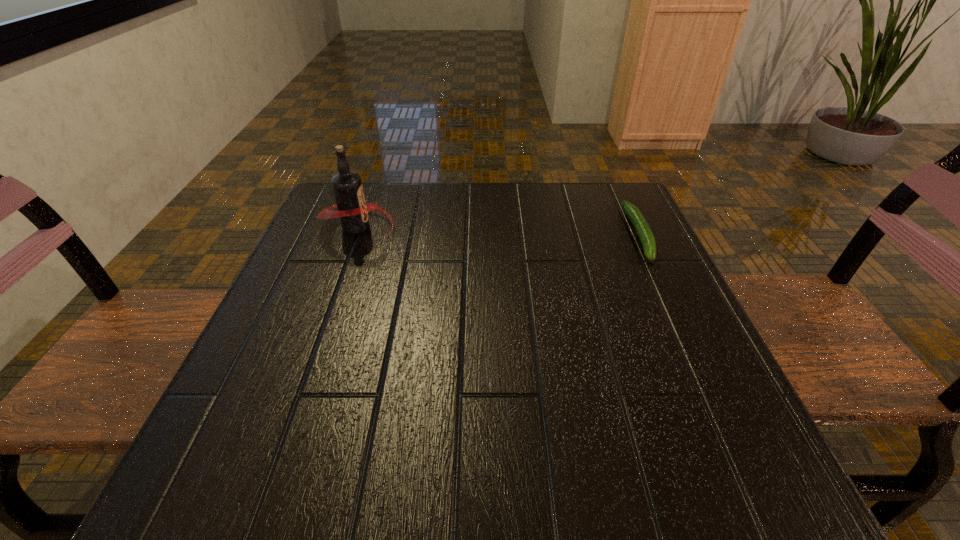
Locate an element on the screen. the left object is located at coordinates (353, 211).

What are the coordinates of `the taller object` in the screenshot? It's located at (353, 211).

Image resolution: width=960 pixels, height=540 pixels. What are the coordinates of `the shorter object` in the screenshot? It's located at (647, 239).

The height and width of the screenshot is (540, 960). Find the location of `the right object`. the right object is located at coordinates (647, 239).

You are a GUI agent. You are given a task and a screenshot of the screen. Output one action in this format:
    pyautogui.click(x=<x>, y=<y>)
    Task: Click on the vacant space located 0.100m on the label of the root beer
    The height and width of the screenshot is (540, 960).
    Given the screenshot: What is the action you would take?
    pyautogui.click(x=440, y=227)

Find the location of `vacant space located on the front-facing side of the right object`. vacant space located on the front-facing side of the right object is located at coordinates (665, 290).

Locate an element on the screen. The height and width of the screenshot is (540, 960). root beer situated at the far edge is located at coordinates [353, 211].

Where is `zucchini that is at the far edge`? The width and height of the screenshot is (960, 540). zucchini that is at the far edge is located at coordinates (647, 239).

Where is `object that is positioned at the left edge`? The width and height of the screenshot is (960, 540). object that is positioned at the left edge is located at coordinates (353, 211).

The image size is (960, 540). Find the location of `object positioned at the right edge`. object positioned at the right edge is located at coordinates (647, 239).